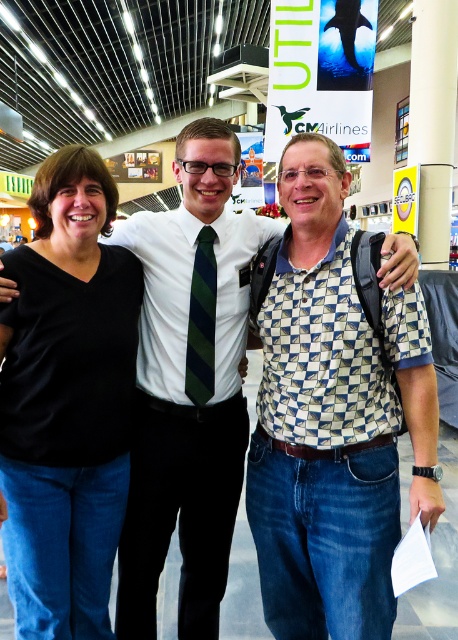
Question: Is checkered fabric shirt at center positioned at the back of green striped tie at center?

Choices:
 (A) no
 (B) yes

Answer: (A)

Question: Considering the real-world distances, which object is farthest from the black matte shirt at left?

Choices:
 (A) green striped tie at center
 (B) checkered fabric shirt at center

Answer: (B)

Question: Can you confirm if checkered fabric shirt at center is wider than black matte shirt at left?

Choices:
 (A) yes
 (B) no

Answer: (A)

Question: Which point is farther from the camera taking this photo?

Choices:
 (A) (69, 572)
 (B) (206, 240)
 (C) (372, 541)

Answer: (B)

Question: Among these objects, which one is nearest to the camera?

Choices:
 (A) checkered fabric shirt at center
 (B) black matte shirt at left

Answer: (A)

Question: Observing the image, what is the correct spatial positioning of checkered fabric shirt at center in reference to green striped tie at center?

Choices:
 (A) left
 (B) right

Answer: (B)